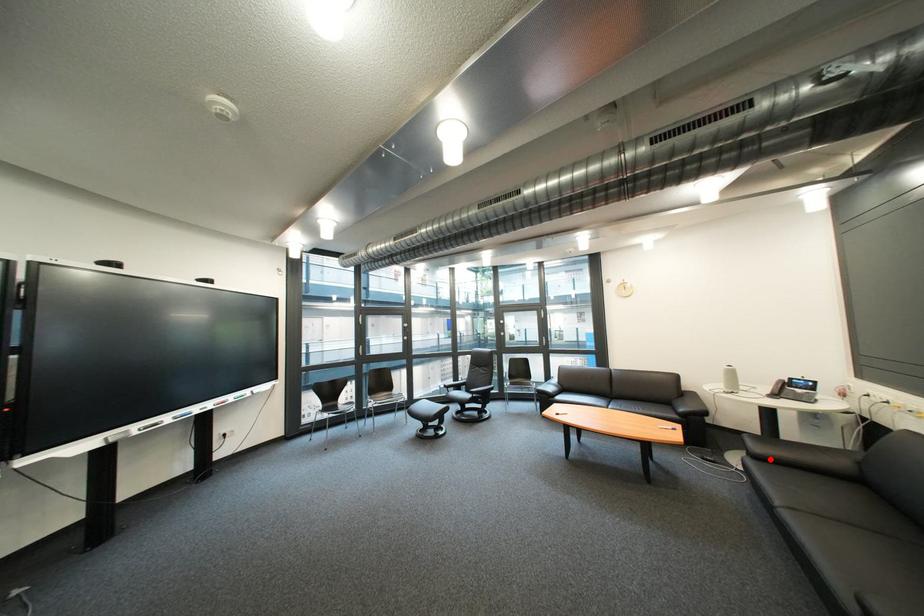
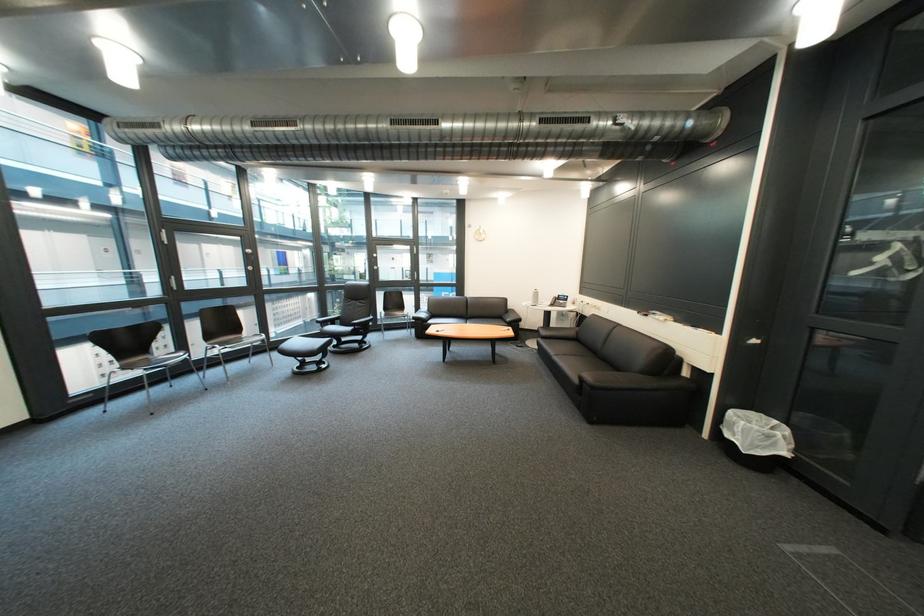
Find the pixel in the second image that matches the highlighted location in the first image.

(556, 339)